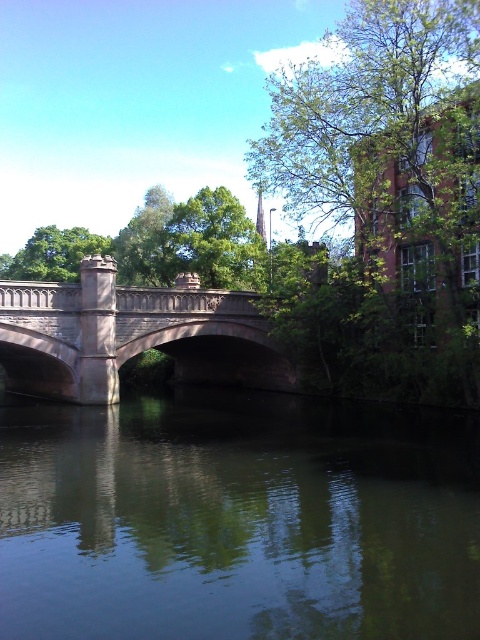
Does green reflective water at center appear over matte stone bridge at center?

No, green reflective water at center is not above matte stone bridge at center.

Is point (86, 605) more distant than point (70, 330)?

No.

Find the location of a particular element. green reflective water at center is located at coordinates (238, 518).